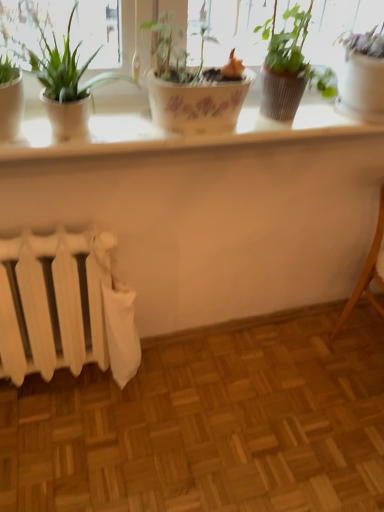
Identify the location of free space in front of light brown wooden chair at lower right. (355, 409).